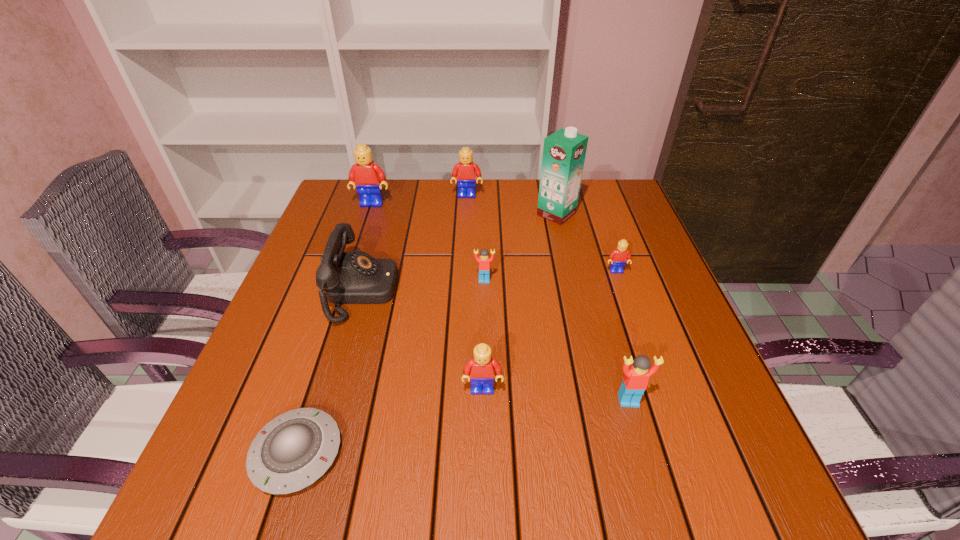
Find the location of a particular element. This screenshot has width=960, height=540. free space between the bigger red Lego and the shortest object is located at coordinates (463, 427).

You are a GUI agent. You are given a task and a screenshot of the screen. Output one action in this format:
    pyautogui.click(x=<x>, y=<y>)
    Task: Click on the vacant area between the rightmost object and the fourth farthest Lego
    
    Given the screenshot: What is the action you would take?
    pyautogui.click(x=550, y=275)

Identify the location of empty space between the nearest yellow Lego and the gray telephone. The image size is (960, 540). (422, 340).

Locate an element on the screen. The image size is (960, 540). free area in between the third biggest yellow Lego and the saucer is located at coordinates (390, 421).

Locate an element on the screen. Image resolution: width=960 pixels, height=540 pixels. free point between the carton and the third smallest yellow Lego is located at coordinates (512, 205).

The image size is (960, 540). I want to click on empty location between the nearest object and the farthest object, so (x=382, y=325).

Choose which object is the fourth nearest neighbor to the fifth shortest Lego. Please provide its 2D coordinates. Your answer should be formatted as a tuple, i.e. [(x, y)], where the tuple contains the x and y coordinates of a point satisfying the conditions above.

[(484, 261)]

Locate which object is the second closest to the nearest yellow Lego. Please provide its 2D coordinates. Your answer should be formatted as a tuple, i.e. [(x, y)], where the tuple contains the x and y coordinates of a point satisfying the conditions above.

[(292, 451)]

Where is `the second closest Lego relative to the nearest yellow Lego`? the second closest Lego relative to the nearest yellow Lego is located at coordinates (484, 261).

I want to click on Lego object that ranks as the second closest to the nearest yellow Lego, so click(x=484, y=261).